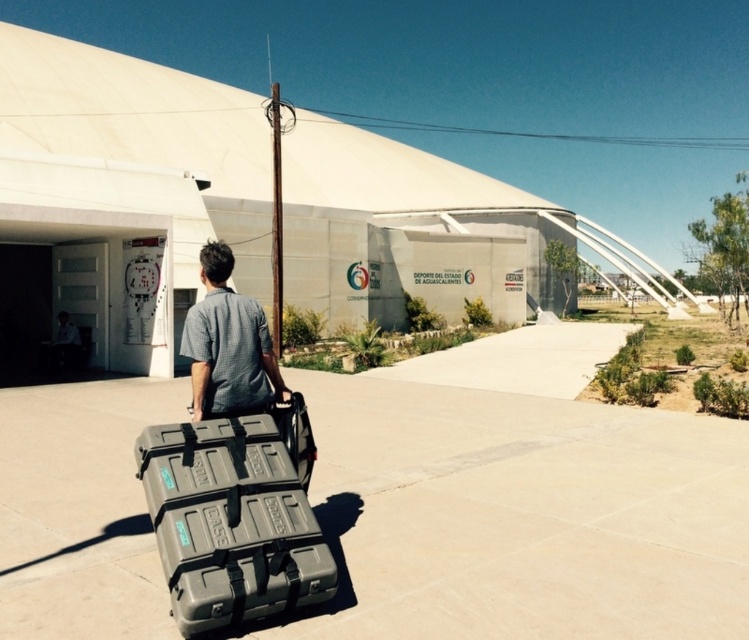
You are standing in the outdoor scene and want to pick up the matte gray case at center and the gray cotton shirt at center. Which object is easier to reach without moving your position?

The matte gray case at center is closer to the viewer than the gray cotton shirt at center, so it is easier to reach without moving your position.

You are a delivery person needing to pass through a narrow doorway that is 1.2 meters wide. You are currently holding the matte gray case at center and wearing the gray cotton shirt at center. Can you pass through the doorway without removing the case?

The matte gray case at center might be wider than gray cotton shirt at center. Since the case could be wider than 1.2 meters, it might not fit through the doorway. You should check the case width before attempting to pass.